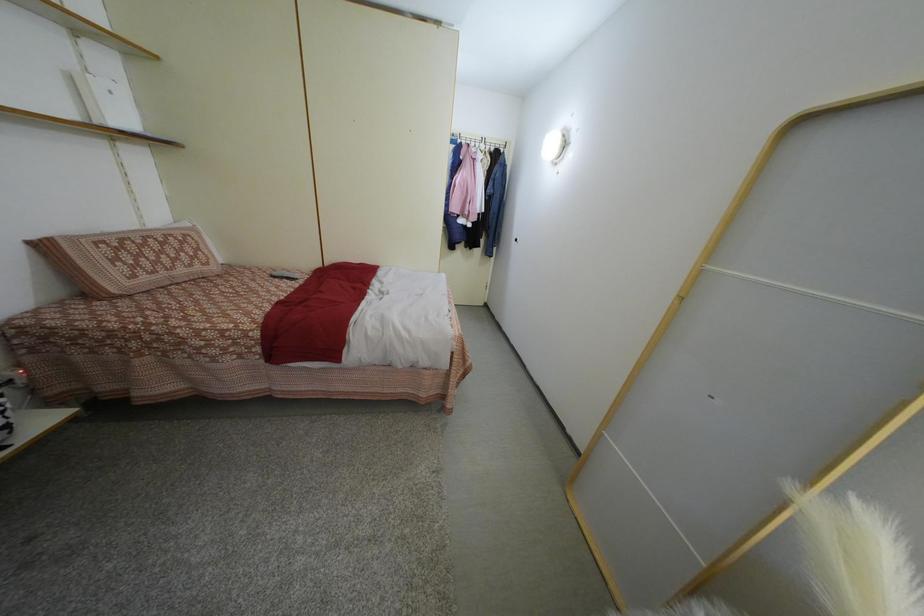
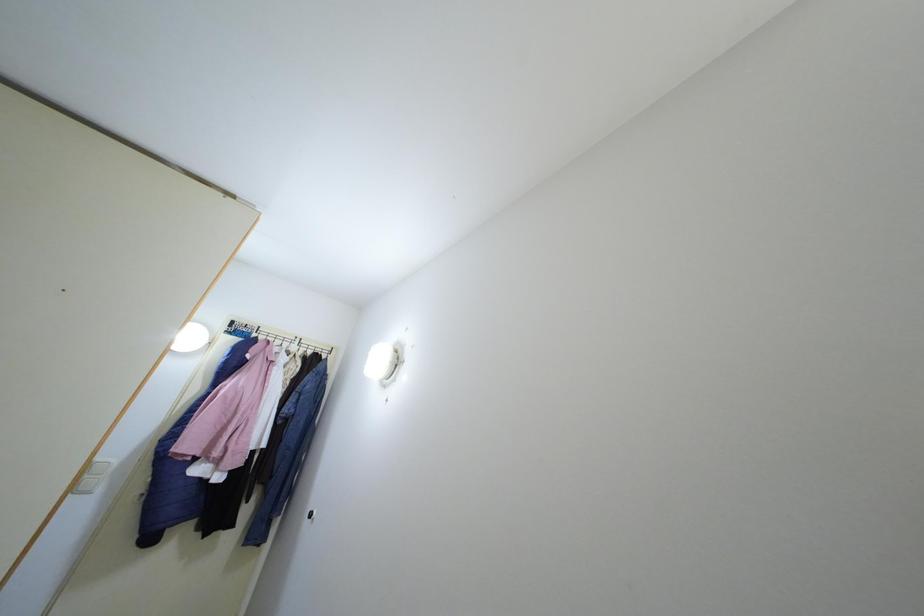
The images are taken continuously from a first-person perspective. In which direction is your viewpoint rotating?

The camera's rotation is toward right-up.